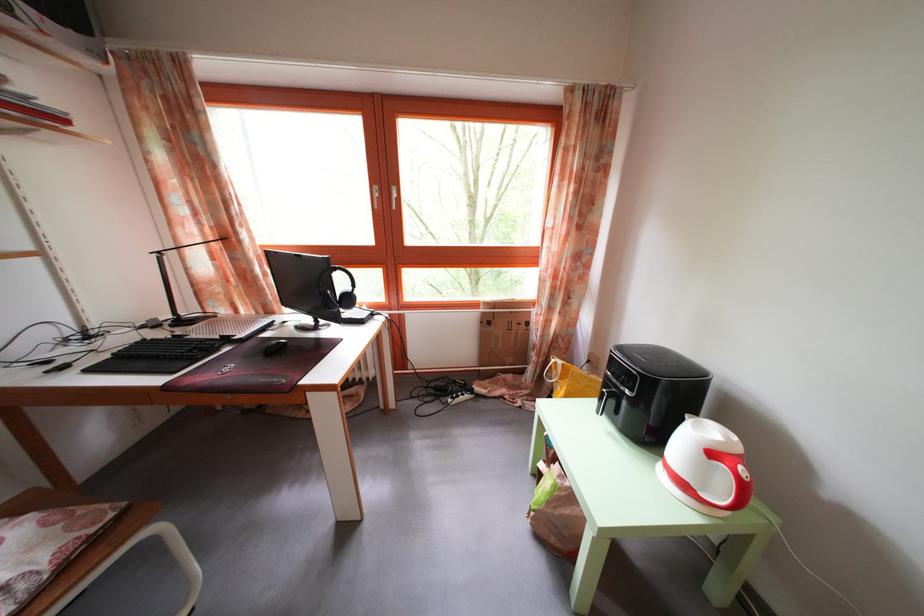
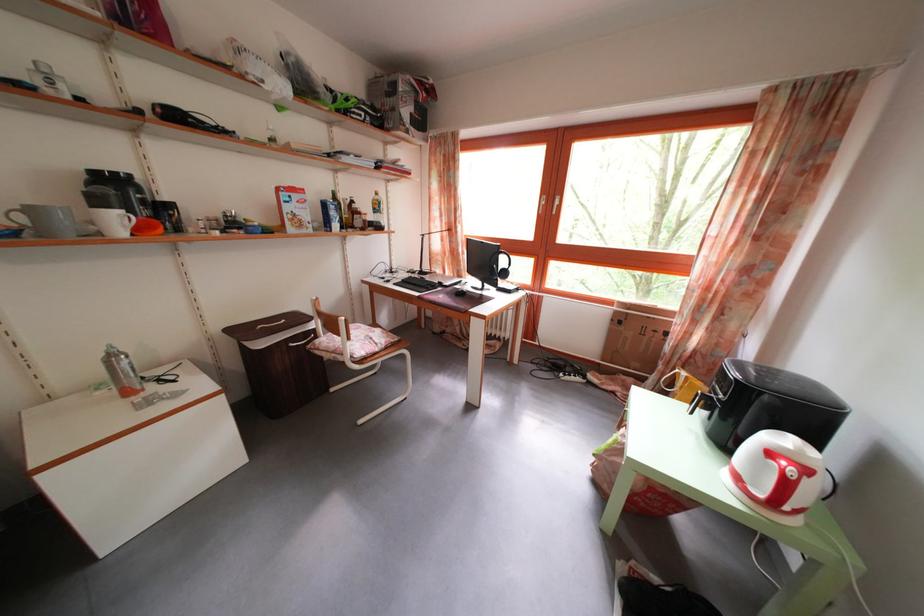
Locate, in the second image, the point that corresponds to [747,464] in the first image.

(812, 477)